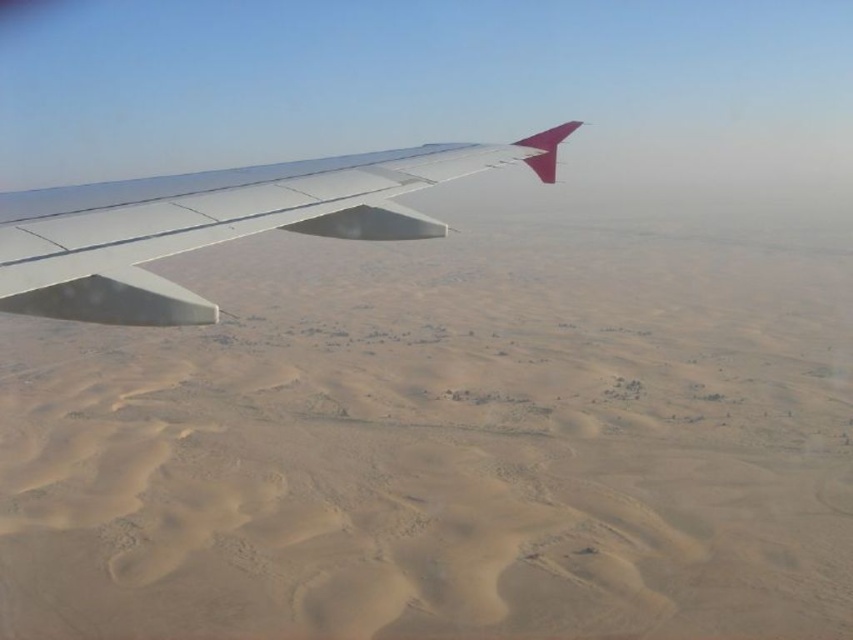
You are a photographer looking to capture the desert landscape from the airplane window. You notice two points marked on your camera screen at coordinates point (107, 556) and point (123, 196). Which point is closer to the camera lens?

Point (123, 196) is closer to the camera lens because it is less further than point (107, 556), which is further away.

You are a passenger seated near the window and want to take a photo of the desert sand at left and the metallic wing at upper left. Which object should you focus on first if you want to capture both in the same frame without moving the camera?

The metallic wing at upper left should be focused on first because the desert sand at left is to the right of metallic wing at upper left, so adjusting focus to include both would require ensuring the wing is in frame before the sand, but since they are positioned side by side, you can capture both by centering the camera between them.